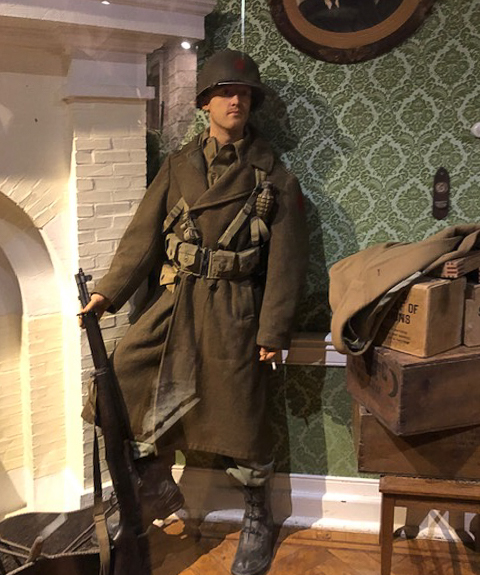
You are a GUI agent. You are given a task and a screenshot of the screen. Output one action in this format:
    pyautogui.click(x=<x>, y=<y>)
    Task: Click on the box
    
    Given the screenshot: What is the action you would take?
    pyautogui.click(x=417, y=325)